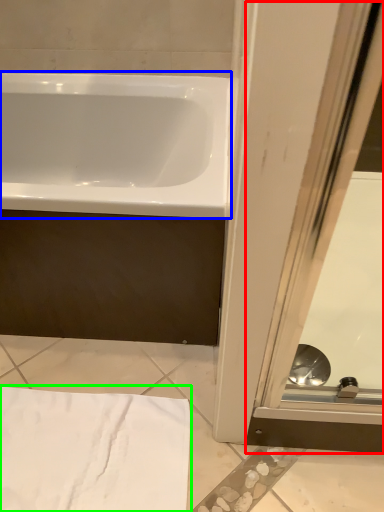
Question: Which object is positioned farthest from screen door (highlighted by a red box)? Select from bathtub (highlighted by a blue box) and bath towel (highlighted by a green box).

Choices:
 (A) bathtub
 (B) bath towel

Answer: (A)